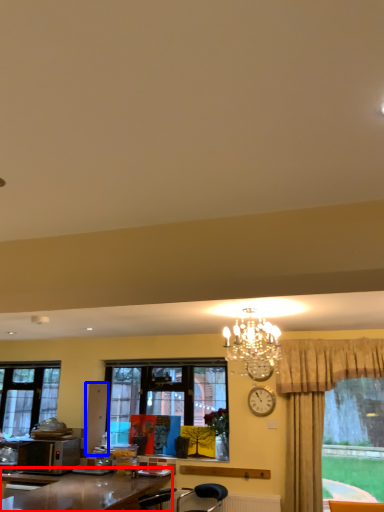
Question: Which object appears farthest to the camera in this image, desk (highlighted by a red box) or cabinetry (highlighted by a blue box)?

Choices:
 (A) desk
 (B) cabinetry

Answer: (B)